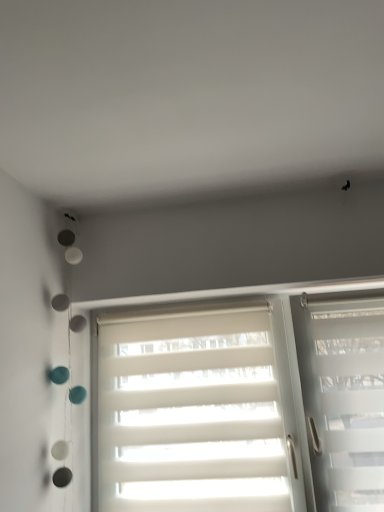
Question: Visually, is transparent plastic window at right, the first window when ordered from right to left, positioned to the left or to the right of white matte blinds at center, marked as the 2th window in a right-to-left arrangement?

Choices:
 (A) left
 (B) right

Answer: (B)

Question: Considering their positions, is transparent plastic window at right, the second window in the left-to-right sequence, located in front of or behind white matte blinds at center, marked as the 2th window in a right-to-left arrangement?

Choices:
 (A) front
 (B) behind

Answer: (A)

Question: Which is correct: transparent plastic window at right, the first window when ordered from right to left, is inside white matte blinds at center, the 1th window from the left, or outside of it?

Choices:
 (A) inside
 (B) outside

Answer: (B)

Question: Looking at their shapes, would you say white matte blinds at center, the 1th window from the left, is wider or thinner than transparent plastic window at right, the second window in the left-to-right sequence?

Choices:
 (A) thin
 (B) wide

Answer: (A)

Question: In terms of size, does white matte blinds at center, the 1th window from the left, appear bigger or smaller than transparent plastic window at right, the second window in the left-to-right sequence?

Choices:
 (A) small
 (B) big

Answer: (A)

Question: Choose the correct answer: Is white matte blinds at center, the 1th window from the left, inside transparent plastic window at right, the first window when ordered from right to left, or outside it?

Choices:
 (A) inside
 (B) outside

Answer: (B)

Question: Relative to transparent plastic window at right, the second window in the left-to-right sequence, is white matte blinds at center, marked as the 2th window in a right-to-left arrangement, in front or behind?

Choices:
 (A) behind
 (B) front

Answer: (A)